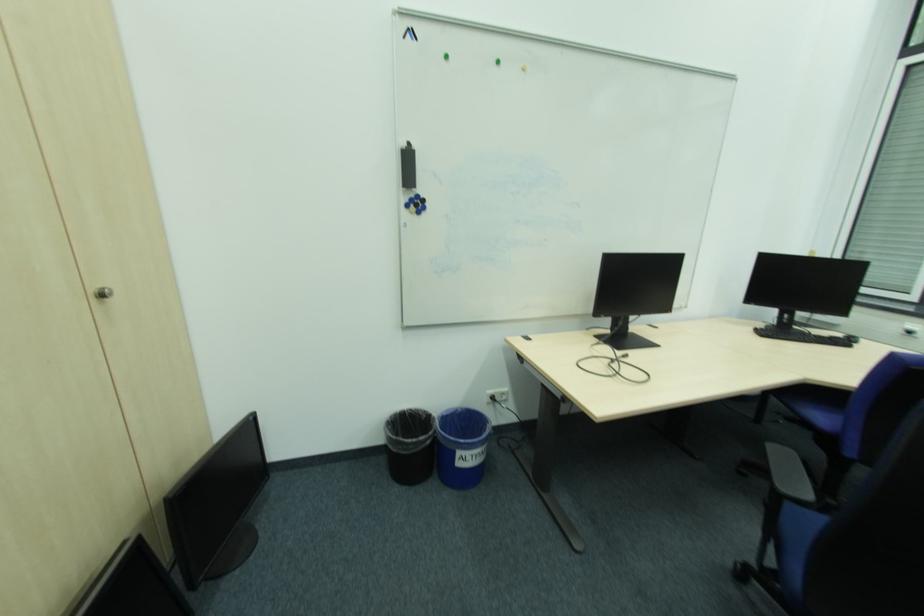
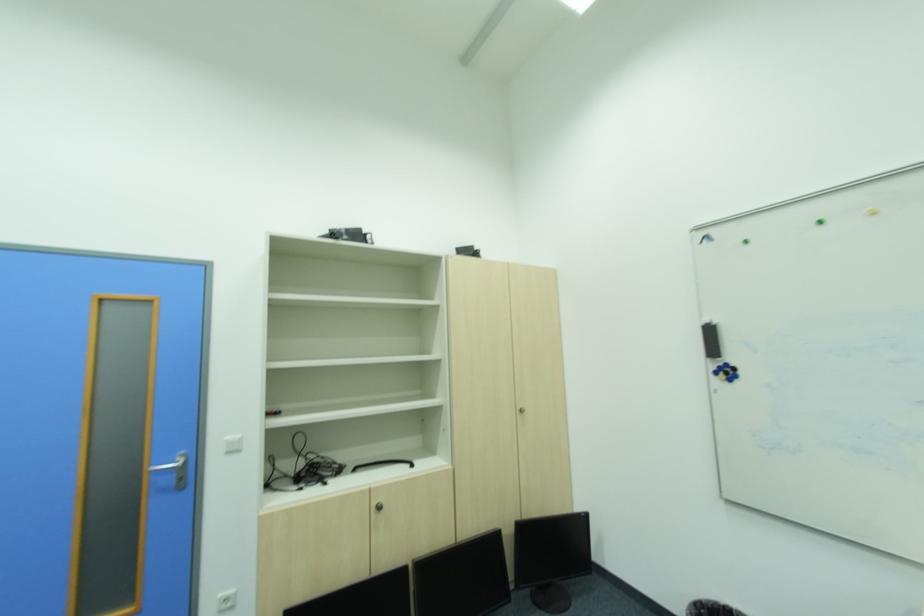
Find the pixel in the second image that matches the point at 426,206 in the first image.

(736, 371)